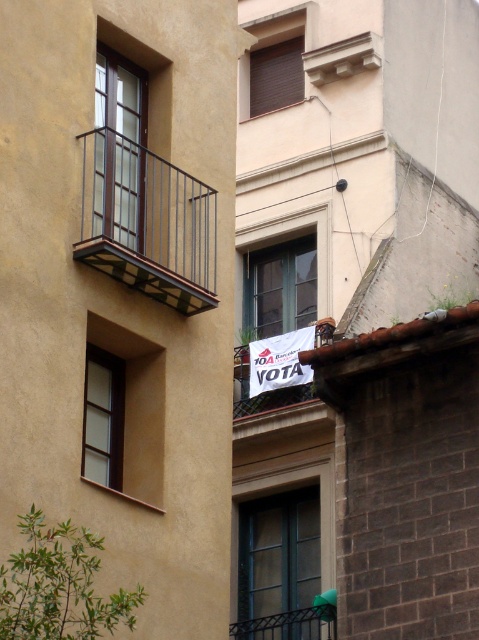
What do you see at coordinates (147, 221) in the screenshot? The height and width of the screenshot is (640, 479). I see `metallic glass balcony at upper left` at bounding box center [147, 221].

Does metallic glass balcony at upper left appear over smooth stone balcony at upper center?

No, metallic glass balcony at upper left is not above smooth stone balcony at upper center.

Measure the distance between metallic glass balcony at upper left and camera.

48.89 meters

The image size is (479, 640). Find the location of `metallic glass balcony at upper left`. metallic glass balcony at upper left is located at coordinates (147, 221).

This screenshot has width=479, height=640. Describe the element at coordinates (278, 566) in the screenshot. I see `matte glass window at center` at that location.

The image size is (479, 640). What do you see at coordinates (278, 566) in the screenshot?
I see `matte glass window at center` at bounding box center [278, 566].

Locate an element on the screen. matte glass window at center is located at coordinates (278, 566).

Does point (269, 42) lie in front of point (103, 460)?

No, it is behind (103, 460).

Who is more forward, (300, 38) or (95, 435)?

Positioned in front is point (95, 435).

Locate an element on the screen. This screenshot has height=640, width=479. brown matte window at upper center is located at coordinates (273, 61).